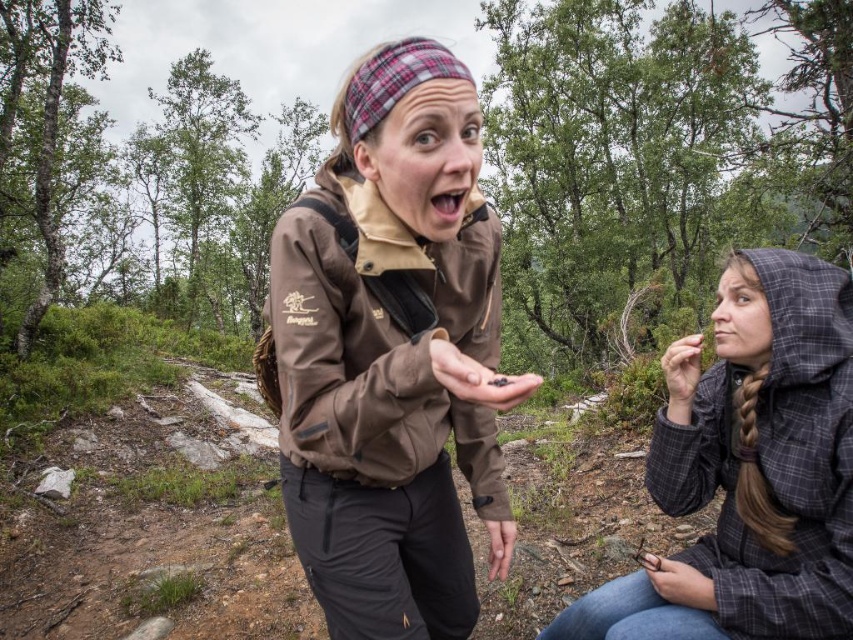
Does green leafy forest at center have a lesser width compared to plaid fabric hood at lower right?

Incorrect, green leafy forest at center's width is not less than plaid fabric hood at lower right's.

Is green leafy forest at center closer to camera compared to plaid fabric hood at lower right?

No.

Who is more forward, (56, 269) or (740, 252)?

Point (740, 252) is more forward.

The height and width of the screenshot is (640, 853). I want to click on green leafy forest at center, so click(x=656, y=152).

Which is more to the left, plaid fabric hood at lower right or black matte seeds at center?

black matte seeds at center is more to the left.

In the scene shown: Does plaid fabric hood at lower right have a smaller size compared to black matte seeds at center?

No.

Who is more distant from viewer, (824, 579) or (433, 339)?

Positioned behind is point (824, 579).

Locate an element on the screen. Image resolution: width=853 pixels, height=640 pixels. plaid fabric hood at lower right is located at coordinates (752, 472).

Does brown softshell jacket at center appear on the right side of matte black hand at lower right?

Incorrect, brown softshell jacket at center is not on the right side of matte black hand at lower right.

Is brown softshell jacket at center smaller than matte black hand at lower right?

No, brown softshell jacket at center is not smaller than matte black hand at lower right.

I want to click on brown softshell jacket at center, so click(389, 353).